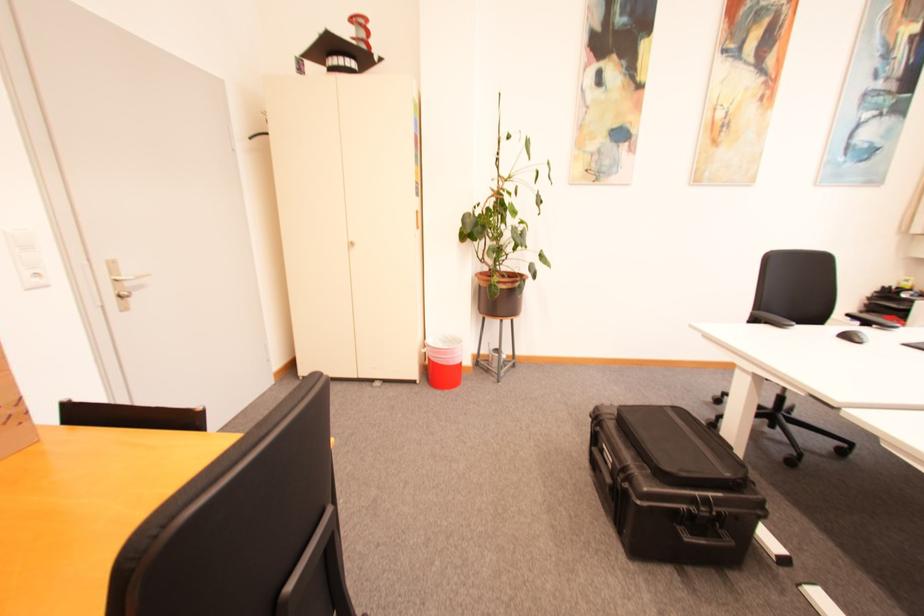
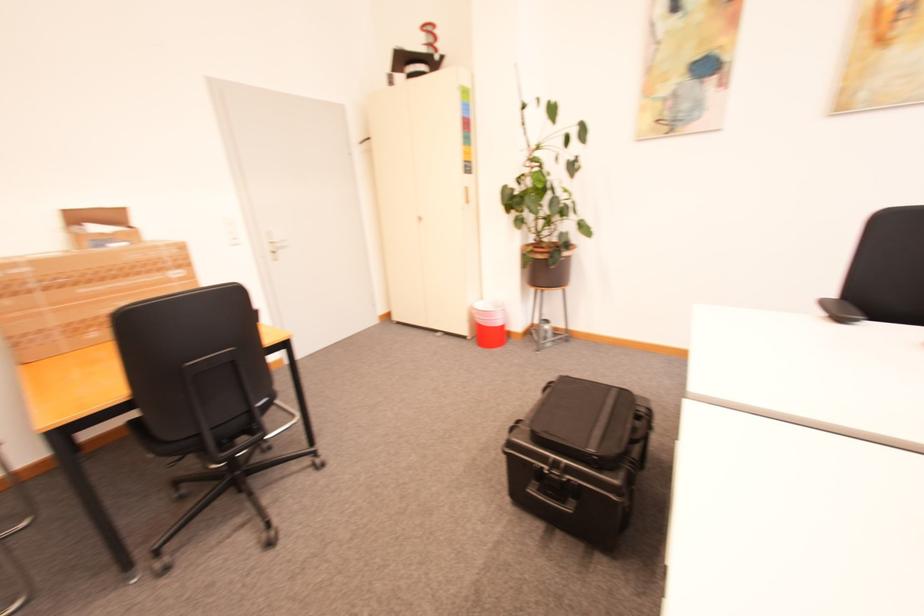
Locate, in the second image, the point that corresponds to point 691,541 in the first image.

(535, 492)